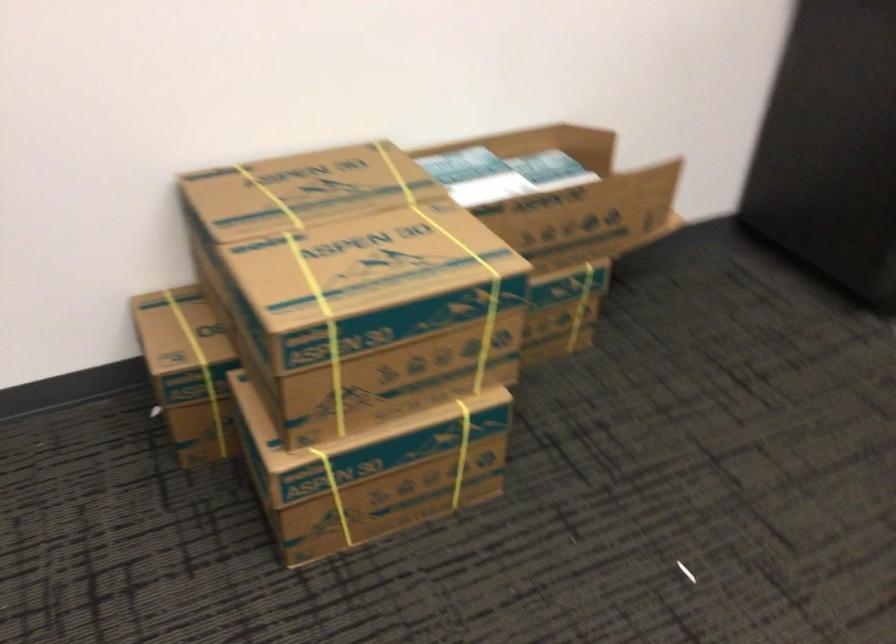
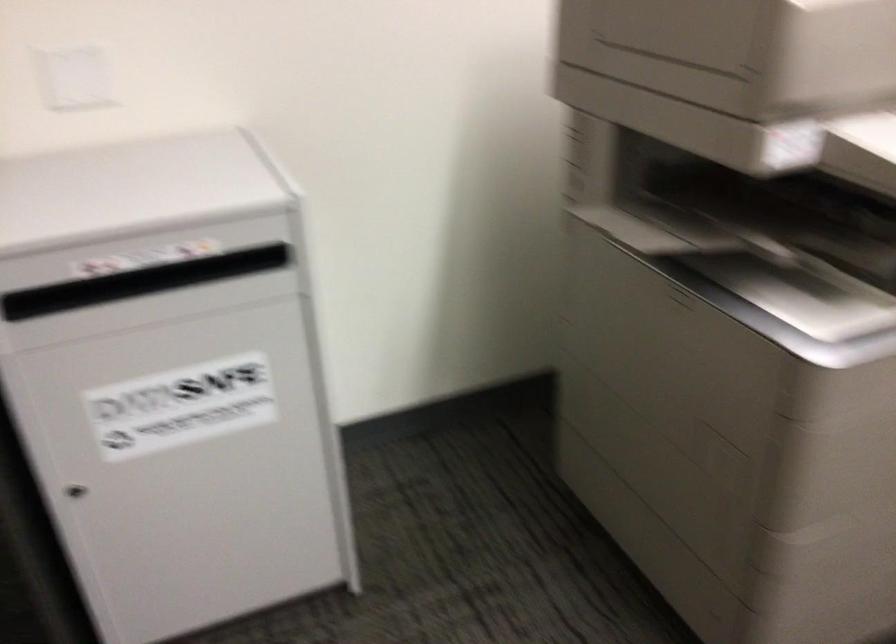
How did the camera likely rotate?

The camera's rotation is toward right-down.